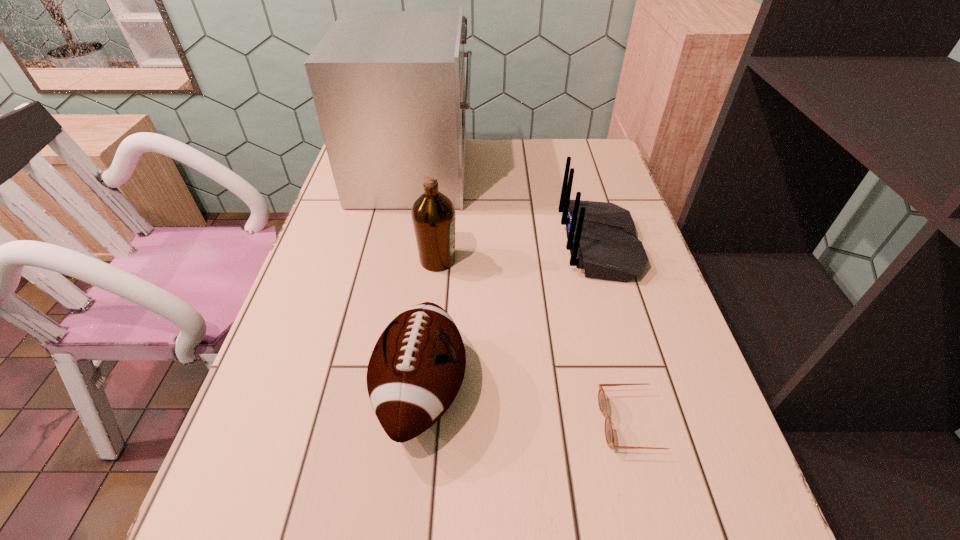
This screenshot has width=960, height=540. Identify the location of toaster oven. (389, 89).

Locate an element on the screen. the farthest object is located at coordinates (389, 89).

Identify the location of olive oil. (433, 214).

This screenshot has width=960, height=540. I want to click on router, so click(x=601, y=236).

Image resolution: width=960 pixels, height=540 pixels. In order to click on football (American) in this screenshot , I will do `click(416, 369)`.

The image size is (960, 540). I want to click on sunglasses, so click(x=609, y=435).

Identify the location of free location located on the front panel of the toaster oven. The height and width of the screenshot is (540, 960). (600, 172).

Where is `vacant space located 0.270m on the label of the olive oil`? This screenshot has width=960, height=540. vacant space located 0.270m on the label of the olive oil is located at coordinates (566, 260).

The width and height of the screenshot is (960, 540). Identify the location of free location located 0.180m on the back of the router. (492, 245).

In order to click on free space located on the back of the router in this screenshot , I will do `click(516, 245)`.